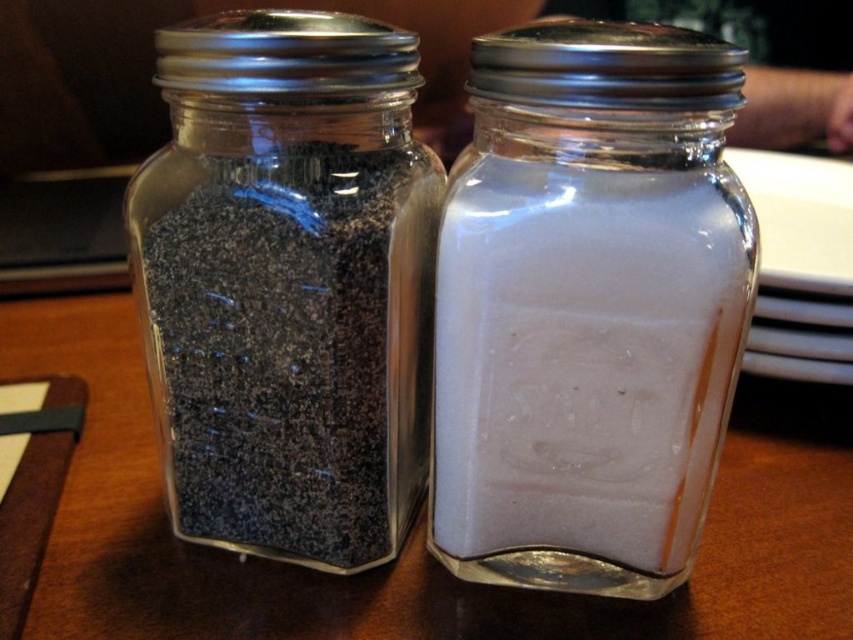
You are setting up a dining table and need to place the white glass salt shaker at center and the matte black pepper at left. If the space between them must be exactly 10 cm, will the current arrangement allow this?

The white glass salt shaker at center is placed to the right of the matte black pepper at left. Since the white glass salt shaker at center is narrower than the matte black pepper at left, there is sufficient space between them to maintain the 10 cm requirement.

You are setting up a dining table and need to place the white glass salt shaker at center and the matte black pepper at left. The table has limited space between two plates. If the distance between the plates is exactly 15 cm, can both items fit side by side without overlapping?

The white glass salt shaker at center is smaller than the matte black pepper at left. Since the distance between the plates is 15 cm, and the combined width of both items must be less than or equal to 15 cm to fit, but without knowing their exact widths, it is impossible to determine if they will fit. However, since the salt shaker is smaller, it might be possible if their combined size is within the 15 cm limit.